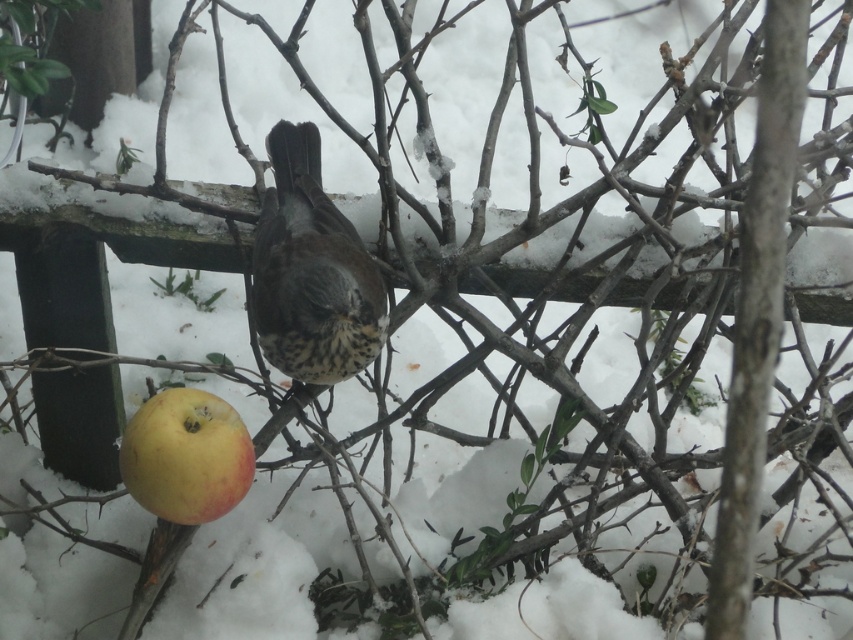
Question: Considering the relative positions of speckled brown bird at center and yellow matte apple at lower left in the image provided, where is speckled brown bird at center located with respect to yellow matte apple at lower left?

Choices:
 (A) below
 (B) above

Answer: (B)

Question: Which point is closer to the camera?

Choices:
 (A) (224, 464)
 (B) (315, 147)

Answer: (A)

Question: Considering the relative positions of speckled brown bird at center and yellow matte apple at lower left in the image provided, where is speckled brown bird at center located with respect to yellow matte apple at lower left?

Choices:
 (A) above
 (B) below

Answer: (A)

Question: Among these points, which one is nearest to the camera?

Choices:
 (A) 238,490
 (B) 341,346

Answer: (A)

Question: Does speckled brown bird at center appear on the left side of yellow matte apple at lower left?

Choices:
 (A) no
 (B) yes

Answer: (A)